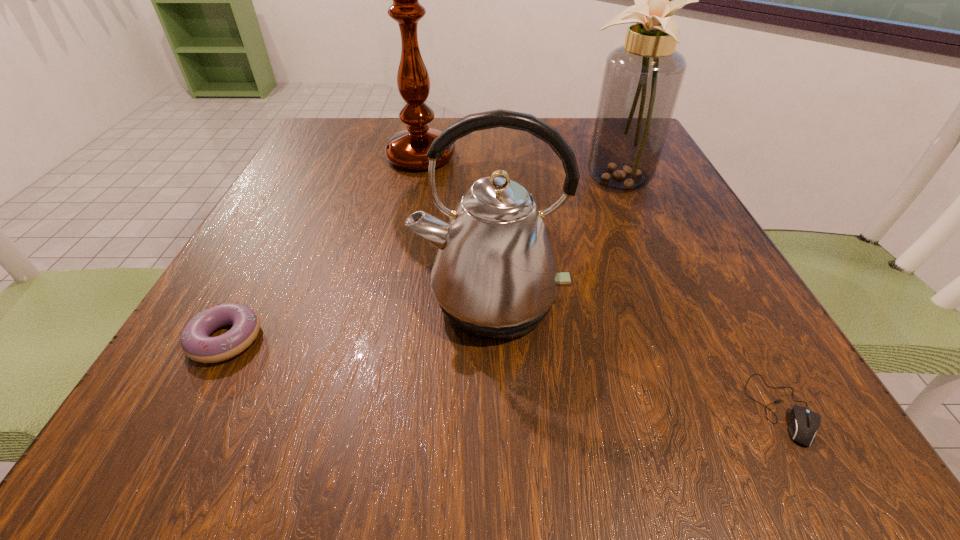
Image resolution: width=960 pixels, height=540 pixels. I want to click on free spot located on the back of the fourth tallest object, so 269,259.

I want to click on free space located 0.160m on the back of the computer mouse, so click(x=714, y=287).

What are the coordinates of `table lamp that is at the far edge` in the screenshot? It's located at (407, 149).

Identify the location of flower arrangement that is at the far edge. The height and width of the screenshot is (540, 960). (642, 79).

At what (x,y) coordinates should I click in order to perform the action: click on object that is positioned at the near edge. Please return your answer as a coordinate pair (x, y). The width and height of the screenshot is (960, 540). Looking at the image, I should click on tap(804, 423).

Find the location of a particular element. Image resolution: width=960 pixels, height=540 pixels. table lamp at the left edge is located at coordinates (407, 149).

Where is `doughnut present at the left edge`? doughnut present at the left edge is located at coordinates (196, 343).

This screenshot has height=540, width=960. Find the location of `flower arrangement that is positioned at the right edge`. flower arrangement that is positioned at the right edge is located at coordinates (642, 79).

Where is `computer mouse that is at the right edge`? This screenshot has height=540, width=960. computer mouse that is at the right edge is located at coordinates (804, 423).

The image size is (960, 540). I want to click on object at the far left corner, so click(x=407, y=149).